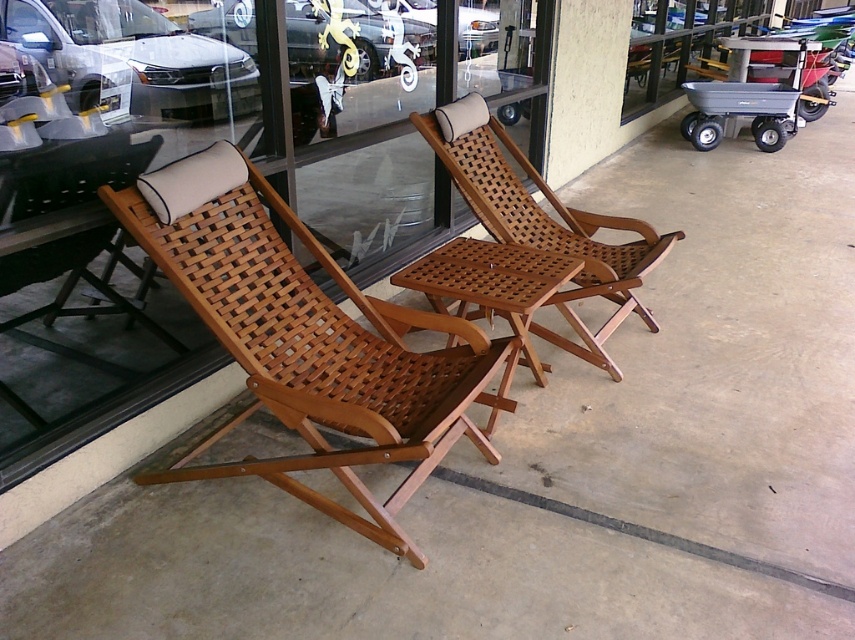
Question: Which of the following is the farthest from the observer?

Choices:
 (A) gray plastic cart at right
 (B) wooden woven chair at center
 (C) wooden woven chair at left

Answer: (A)

Question: Among these points, which one is farthest from the camera?

Choices:
 (A) (124, 40)
 (B) (753, 84)
 (C) (310, 394)
 (D) (531, 248)

Answer: (B)

Question: Is wooden woven chair at center to the left of gray plastic cart at right from the viewer's perspective?

Choices:
 (A) no
 (B) yes

Answer: (B)

Question: In this image, where is wooden woven chair at left located relative to gray plastic cart at right?

Choices:
 (A) above
 (B) below

Answer: (B)

Question: Is wooden woven chair at left to the left of wooden woven chair at center from the viewer's perspective?

Choices:
 (A) no
 (B) yes

Answer: (B)

Question: Which point appears closest to the camera in this image?

Choices:
 (A) (469, 372)
 (B) (113, 42)
 (C) (747, 90)

Answer: (A)